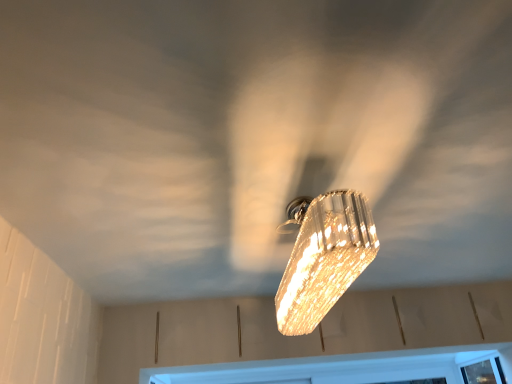
Question: Is clear crystal light fixture at center not near white plastic window frame at bottom?

Choices:
 (A) yes
 (B) no

Answer: (A)

Question: Considering the relative sizes of clear crystal light fixture at center and white plastic window frame at bottom in the image provided, is clear crystal light fixture at center wider than white plastic window frame at bottom?

Choices:
 (A) no
 (B) yes

Answer: (A)

Question: Could you tell me if clear crystal light fixture at center is turned towards white plastic window frame at bottom?

Choices:
 (A) yes
 (B) no

Answer: (B)

Question: Can you confirm if clear crystal light fixture at center is smaller than white plastic window frame at bottom?

Choices:
 (A) yes
 (B) no

Answer: (B)

Question: Does clear crystal light fixture at center appear on the left side of white plastic window frame at bottom?

Choices:
 (A) no
 (B) yes

Answer: (B)

Question: Can you confirm if clear crystal light fixture at center is taller than white plastic window frame at bottom?

Choices:
 (A) no
 (B) yes

Answer: (B)

Question: Is white plastic window frame at bottom far away from clear crystal light fixture at center?

Choices:
 (A) yes
 (B) no

Answer: (A)

Question: Can you confirm if white plastic window frame at bottom is thinner than clear crystal light fixture at center?

Choices:
 (A) no
 (B) yes

Answer: (A)

Question: From a real-world perspective, is white plastic window frame at bottom under clear crystal light fixture at center?

Choices:
 (A) yes
 (B) no

Answer: (A)

Question: Would you say white plastic window frame at bottom contains clear crystal light fixture at center?

Choices:
 (A) yes
 (B) no

Answer: (B)

Question: Is white plastic window frame at bottom next to clear crystal light fixture at center?

Choices:
 (A) yes
 (B) no

Answer: (B)

Question: Is white plastic window frame at bottom not inside clear crystal light fixture at center?

Choices:
 (A) yes
 (B) no

Answer: (A)

Question: Is clear crystal light fixture at center inside or outside of white plastic window frame at bottom?

Choices:
 (A) outside
 (B) inside

Answer: (A)